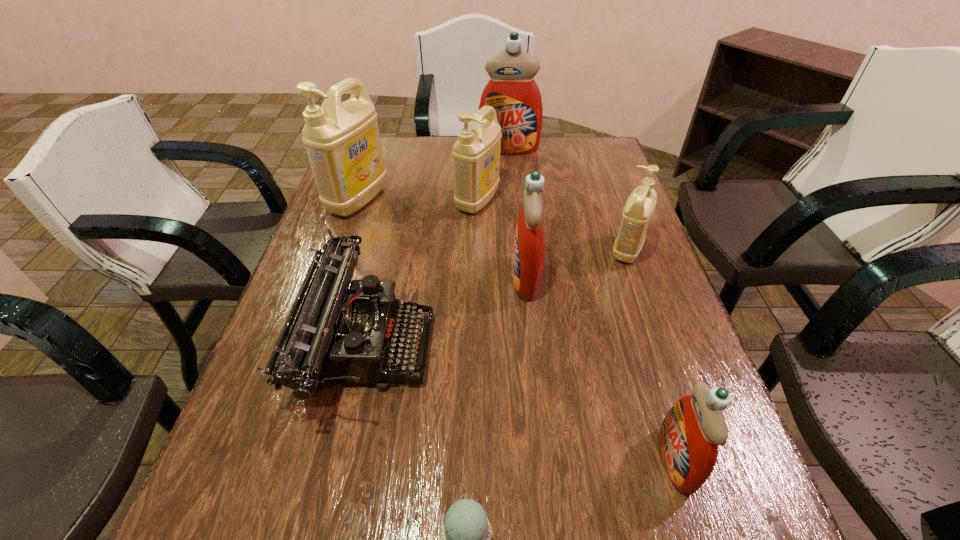
The height and width of the screenshot is (540, 960). Find the location of `vacant space that's between the nearest detergent and the typewriter`. vacant space that's between the nearest detergent and the typewriter is located at coordinates (521, 402).

This screenshot has height=540, width=960. What are the coordinates of `empty space between the farthest red detergent and the second farthest red detergent` in the screenshot? It's located at (516, 214).

Locate an element on the screen. vacant point located between the second smallest red detergent and the second beige detergent from right to left is located at coordinates (501, 239).

Find the location of a particular element. This screenshot has height=540, width=960. blank region between the nearest red detergent and the second beige detergent from left to right is located at coordinates (577, 330).

Identify the location of blank region between the leftmost beige detergent and the second farthest red detergent. (442, 239).

Identify the location of empty space that is in between the rightmost red detergent and the second smallest beige detergent. (577, 330).

This screenshot has height=540, width=960. What are the coordinates of `object that is the sixth closest to the farthest red detergent` in the screenshot? It's located at pos(689,435).

Identify the location of object that is the sixth nearest to the nearest detergent. (342, 140).

Where is `detergent that stands as the fourth closest to the blue ice cream`? detergent that stands as the fourth closest to the blue ice cream is located at coordinates coord(476,155).

This screenshot has width=960, height=540. In order to click on detergent identified as the fifth closest to the rightmost red detergent in this screenshot , I will do `click(513, 93)`.